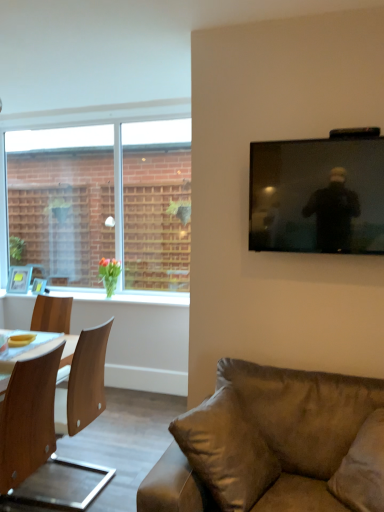
Question: Based on their sizes in the image, would you say wooden chair at left is bigger or smaller than green glossy vase at left?

Choices:
 (A) big
 (B) small

Answer: (A)

Question: Visually, is wooden chair at left positioned to the left or to the right of green glossy vase at left?

Choices:
 (A) left
 (B) right

Answer: (A)

Question: Considering the real-world distances, which object is closest to the wooden photo frame at left, the 2th picture frame viewed from the right?

Choices:
 (A) brown leather couch at lower right
 (B) wooden chair at left
 (C) yellow matte bowl at lower left
 (D) green glossy vase at left
 (E) wooden picture frame at left, which is the second picture frame from left to right

Answer: (E)

Question: Which of these objects is positioned closest to the yellow matte bowl at lower left?

Choices:
 (A) black glossy tv at upper right
 (B) brown suede pillow at lower right, which is the second pillow in right-to-left order
 (C) brown leather couch at lower right
 (D) wooden picture frame at left, which is the second picture frame from left to right
 (E) clear glass window at upper left

Answer: (B)